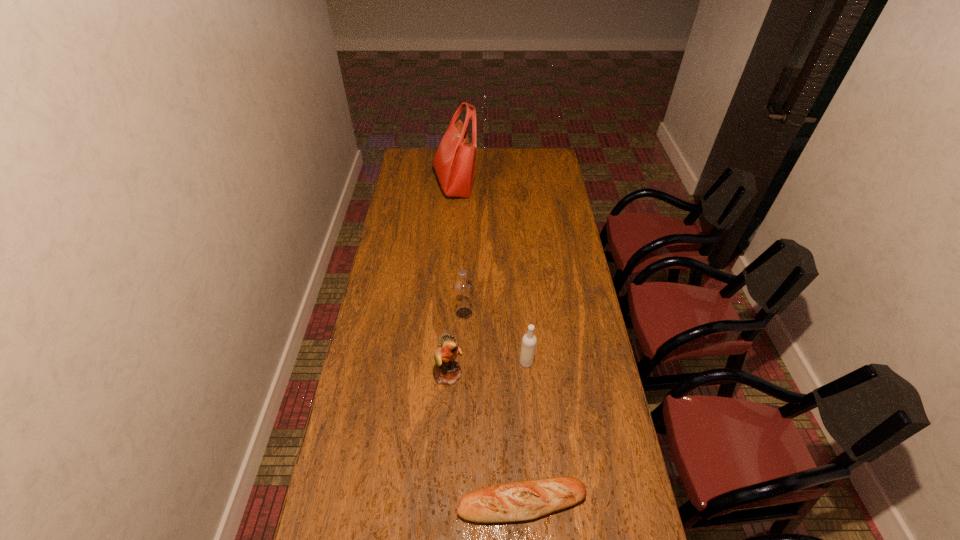
This screenshot has width=960, height=540. What are the coordinates of `vacant area in the image that satisfies the following two spatial constraints: 1. on the back side of the nearest object; 2. on the front label of the farther vodka` in the screenshot? It's located at (511, 313).

Locate an element on the screen. vacant space that satisfies the following two spatial constraints: 1. on the front-facing side of the right vodka; 2. on the left side of the handbag is located at coordinates (442, 363).

Locate an element on the screen. This screenshot has height=540, width=960. vacant area in the image that satisfies the following two spatial constraints: 1. on the front-facing side of the right vodka; 2. on the left side of the farthest object is located at coordinates (442, 363).

Find the location of a particular element. This screenshot has width=960, height=540. blank area in the image that satisfies the following two spatial constraints: 1. on the back side of the baguet; 2. on the front label of the second farthest object is located at coordinates (511, 313).

The height and width of the screenshot is (540, 960). Identify the location of vacant area in the image that satisfies the following two spatial constraints: 1. on the front-facing side of the parrot; 2. on the left side of the shortest object. (443, 502).

Locate an element on the screen. This screenshot has height=540, width=960. free space that satisfies the following two spatial constraints: 1. on the front label of the farther vodka; 2. on the right side of the shortest object is located at coordinates (458, 502).

Where is `vacant space that satisfies the following two spatial constraints: 1. on the front label of the left vodka; 2. on the right side of the nearer vodka`? The width and height of the screenshot is (960, 540). vacant space that satisfies the following two spatial constraints: 1. on the front label of the left vodka; 2. on the right side of the nearer vodka is located at coordinates (463, 363).

This screenshot has height=540, width=960. What are the coordinates of `free space that satisfies the following two spatial constraints: 1. on the front side of the nearer vodka; 2. on the front-facing side of the parrot` in the screenshot? It's located at (527, 374).

Where is `vacant area that satisfies the following two spatial constraints: 1. on the back side of the nearest object; 2. on the front label of the second farthest object`? This screenshot has width=960, height=540. vacant area that satisfies the following two spatial constraints: 1. on the back side of the nearest object; 2. on the front label of the second farthest object is located at coordinates (511, 313).